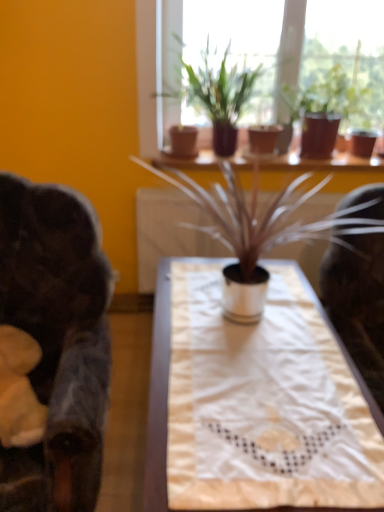
Question: From the image's perspective, is white metallic pot at center, which appears as the 1th houseplant when viewed from the front, beneath matte brown pot at upper center, which is the 3th houseplant in front-to-back order?

Choices:
 (A) no
 (B) yes

Answer: (B)

Question: Is white metallic pot at center, which appears as the 1th houseplant when viewed from the front, at the right side of matte brown pot at upper center, arranged as the 1th houseplant when viewed from the back?

Choices:
 (A) yes
 (B) no

Answer: (B)

Question: From the image's perspective, is white metallic pot at center, the third houseplant from the back, on matte brown pot at upper center, arranged as the 1th houseplant when viewed from the back?

Choices:
 (A) no
 (B) yes

Answer: (A)

Question: Is white metallic pot at center, which appears as the 1th houseplant when viewed from the front, bigger than matte brown pot at upper center, arranged as the 1th houseplant when viewed from the back?

Choices:
 (A) no
 (B) yes

Answer: (B)

Question: Is white metallic pot at center, the third houseplant from the back, not inside matte brown pot at upper center, which is the 3th houseplant in front-to-back order?

Choices:
 (A) no
 (B) yes

Answer: (B)

Question: Is matte brown pots at upper center taller or shorter than matte brown pot at upper center, arranged as the 1th houseplant when viewed from the back?

Choices:
 (A) short
 (B) tall

Answer: (B)

Question: Is matte brown pots at upper center in front of or behind matte brown pot at upper center, arranged as the 1th houseplant when viewed from the back, in the image?

Choices:
 (A) behind
 (B) front

Answer: (A)

Question: Which is correct: matte brown pots at upper center is inside matte brown pot at upper center, which is the 3th houseplant in front-to-back order, or outside of it?

Choices:
 (A) outside
 (B) inside

Answer: (A)

Question: Visually, is matte brown pots at upper center positioned to the left or to the right of matte brown pot at upper center, which is the 3th houseplant in front-to-back order?

Choices:
 (A) left
 (B) right

Answer: (A)

Question: Relative to matte brown pot at upper center, positioned as the second houseplant in back-to-front order, is white metallic pot at center, the third houseplant from the back, in front or behind?

Choices:
 (A) front
 (B) behind

Answer: (A)

Question: Which is correct: white metallic pot at center, which appears as the 1th houseplant when viewed from the front, is inside matte brown pot at upper center, positioned as the second houseplant in back-to-front order, or outside of it?

Choices:
 (A) inside
 (B) outside

Answer: (B)

Question: Is point (241, 187) closer or farther from the camera than point (173, 96)?

Choices:
 (A) farther
 (B) closer

Answer: (B)

Question: From a real-world perspective, is white metallic pot at center, which appears as the 1th houseplant when viewed from the front, above or below matte brown pot at upper center, positioned as the second houseplant in back-to-front order?

Choices:
 (A) above
 (B) below

Answer: (B)

Question: Considering the positions of dark brown leather rocking chair at left and white fabric table at center in the image, is dark brown leather rocking chair at left taller or shorter than white fabric table at center?

Choices:
 (A) tall
 (B) short

Answer: (A)

Question: Looking at their shapes, would you say dark brown leather rocking chair at left is wider or thinner than white fabric table at center?

Choices:
 (A) thin
 (B) wide

Answer: (A)